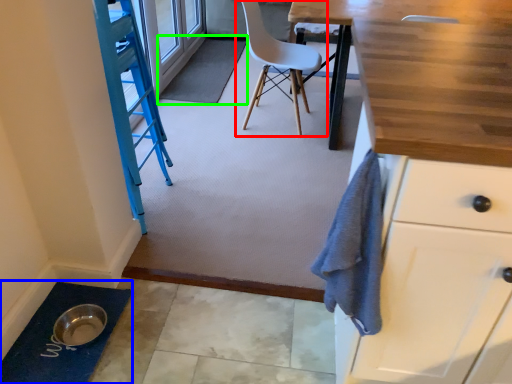
Question: Based on their relative distances, which object is farther from chair (highlighted by a red box)? Choose from bath mat (highlighted by a blue box) and bath mat (highlighted by a green box).

Choices:
 (A) bath mat
 (B) bath mat

Answer: (A)